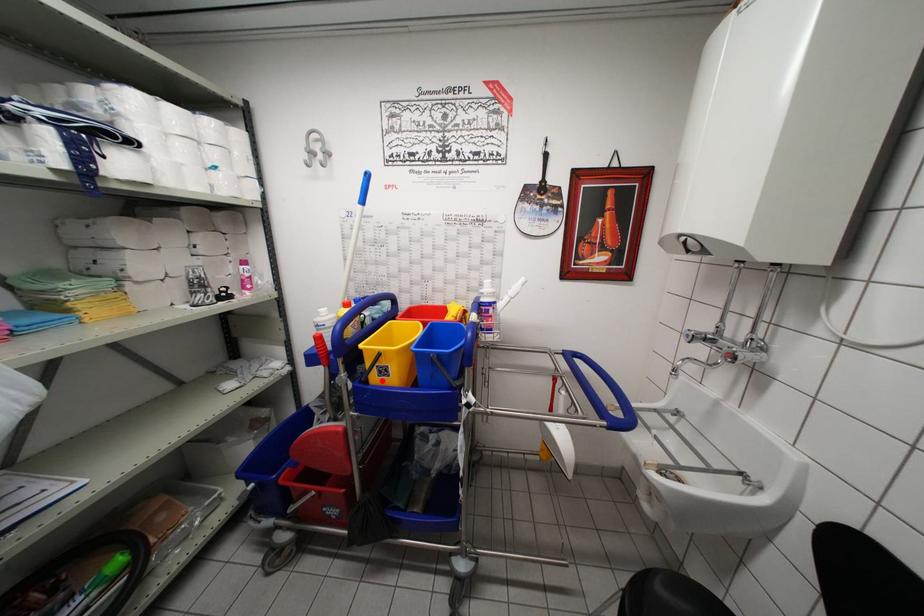
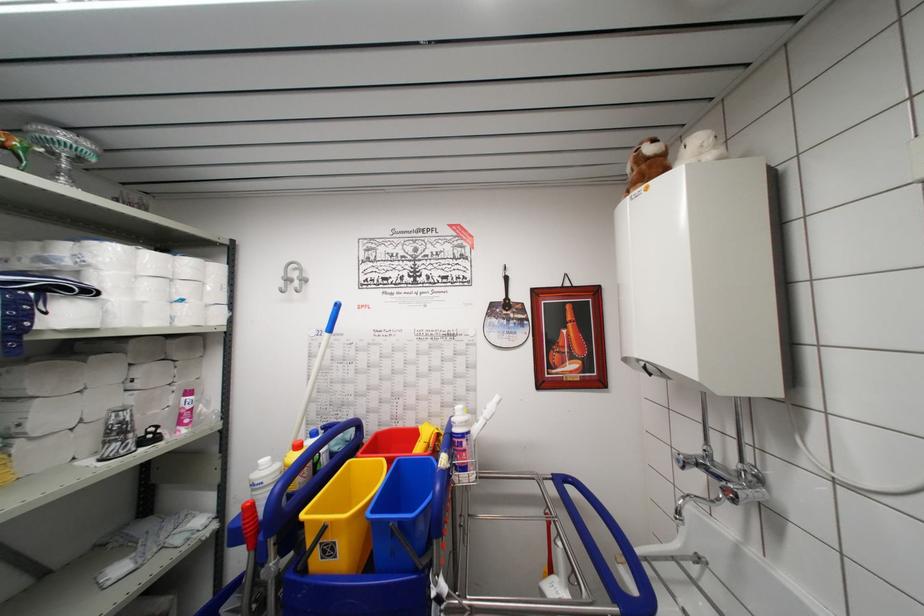
In the second image, find the point that corresponds to the highlighted location in the first image.

(325, 562)